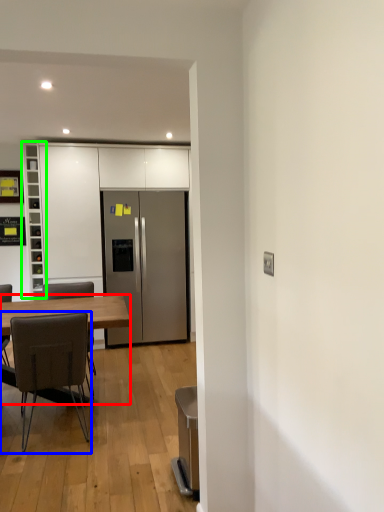
Question: Which is nearer to the desk (highlighted by a red box)? chair (highlighted by a blue box) or cabinetry (highlighted by a green box).

Choices:
 (A) chair
 (B) cabinetry

Answer: (A)